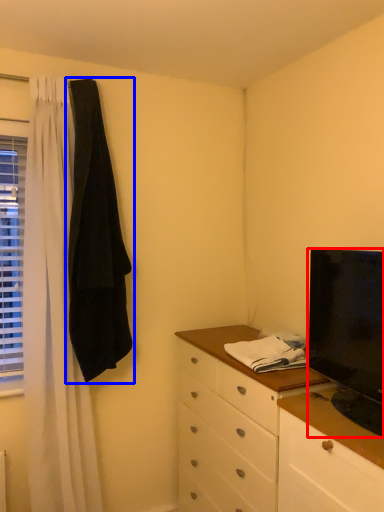
Question: Which of the following is the farthest to the observer, television (highlighted by a red box) or robe (highlighted by a blue box)?

Choices:
 (A) television
 (B) robe

Answer: (B)